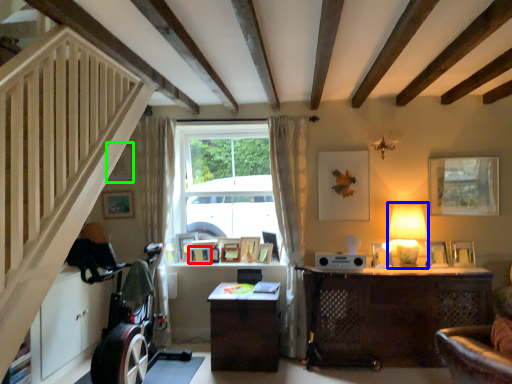
Question: Estimate the real-world distances between objects in this image. Which object is farther from picture frame (highlighted by a red box), table lamp (highlighted by a blue box) or picture frame (highlighted by a green box)?

Choices:
 (A) table lamp
 (B) picture frame

Answer: (A)